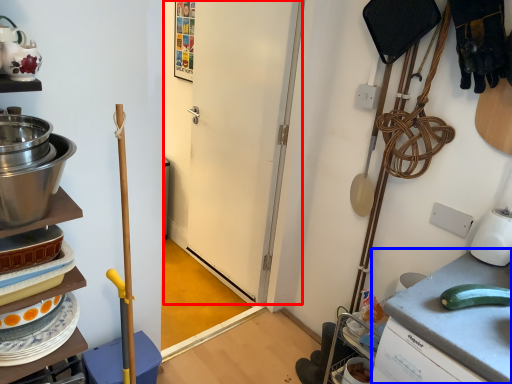
Question: Which point is closer to the camera, door (highlighted by a red box) or counter top (highlighted by a blue box)?

Choices:
 (A) door
 (B) counter top

Answer: (B)